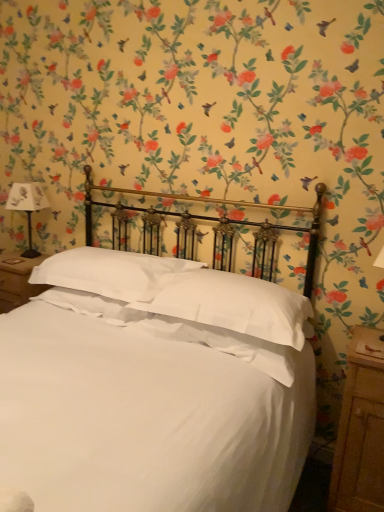
Question: In terms of size, does white paper lampshade at left appear bigger or smaller than wooden nightstand at right?

Choices:
 (A) small
 (B) big

Answer: (A)

Question: Is white paper lampshade at left taller or shorter than wooden nightstand at right?

Choices:
 (A) tall
 (B) short

Answer: (B)

Question: Estimate the real-world distances between objects in this image. Which object is closer to the white soft pillow at center, positioned as the second pillow in right-to-left order?

Choices:
 (A) white paper lampshade at left
 (B) white soft pillow at center, which ranks as the 1th pillow in right-to-left order
 (C) wooden nightstand at right
 (D) white satin bed at center

Answer: (B)

Question: Which object is positioned farthest from the wooden nightstand at right?

Choices:
 (A) white soft pillow at center, which ranks as the first pillow in left-to-right order
 (B) white paper lampshade at left
 (C) white soft pillow at center, which ranks as the 1th pillow in right-to-left order
 (D) white satin bed at center

Answer: (B)